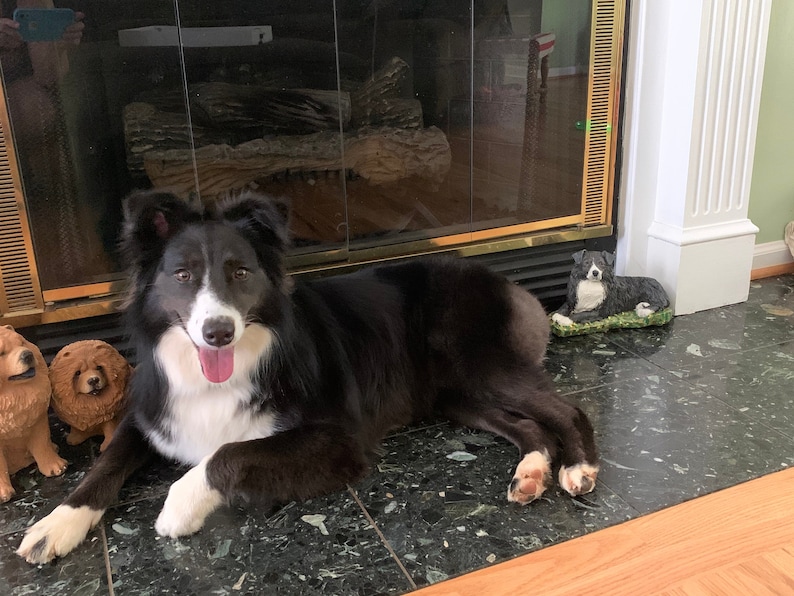
The width and height of the screenshot is (794, 596). In order to click on grey tiles in this screenshot , I will do `click(727, 327)`, `click(757, 378)`, `click(669, 437)`, `click(588, 362)`, `click(784, 290)`, `click(441, 485)`, `click(276, 548)`, `click(25, 484)`, `click(156, 484)`, `click(68, 571)`.